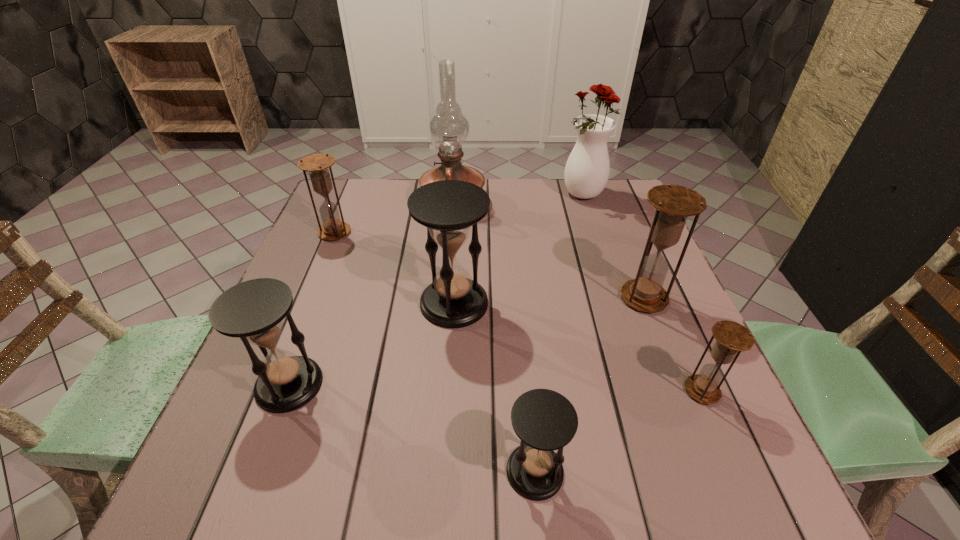
This screenshot has width=960, height=540. I want to click on free space at the right edge of the desktop, so click(693, 353).

This screenshot has height=540, width=960. Identify the location of free space at the far left corner of the desktop. (351, 182).

Locate an element on the screen. The image size is (960, 540). free space between the oil lamp and the second nearest black hourglass is located at coordinates (372, 293).

At what (x,y) coordinates should I click in order to perform the action: click on vacant area between the smallest black hourglass and the leftmost black hourglass. Please return your answer as a coordinate pair (x, y). This screenshot has height=540, width=960. Looking at the image, I should click on (412, 428).

Identify the location of free space between the second biggest black hourglass and the second nearest brown hourglass. This screenshot has height=540, width=960. (467, 341).

The width and height of the screenshot is (960, 540). I want to click on vacant area that lies between the fourth hourglass from left to right and the farthest black hourglass, so click(x=494, y=387).

Identify the location of free spot between the oil lamp and the second tallest object. [x=518, y=199].

At what (x,y) coordinates should I click in order to perform the action: click on vacant space that's between the oil lamp and the farthest hourglass. Please return your answer as a coordinate pair (x, y). Image resolution: width=960 pixels, height=540 pixels. Looking at the image, I should click on (394, 218).

Find the location of a particular element. This screenshot has width=960, height=540. free space between the second biggest brown hourglass and the second nearest black hourglass is located at coordinates (312, 308).

This screenshot has width=960, height=540. What are the coordinates of `blank region between the farthest black hourglass and the second nearest brown hourglass` in the screenshot? It's located at [x=549, y=300].